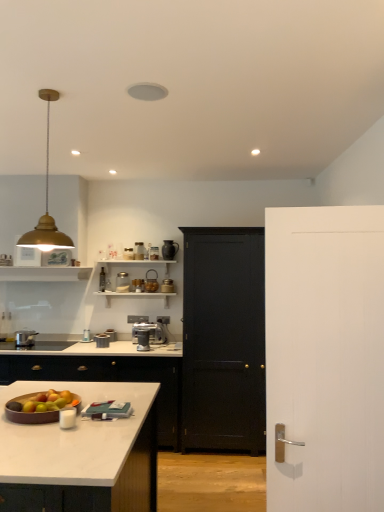
Locate an element on the screen. The image size is (384, 512). free spot to the right of matte silver pot at left is located at coordinates (51, 346).